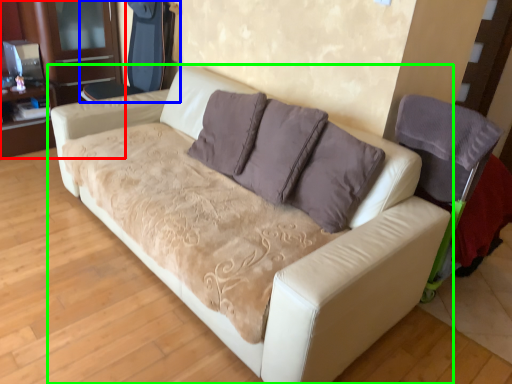
Question: Estimate the real-world distances between objects in this image. Which object is closer to dresser (highlighted by a red box), armchair (highlighted by a blue box) or studio couch (highlighted by a green box)?

Choices:
 (A) armchair
 (B) studio couch

Answer: (A)